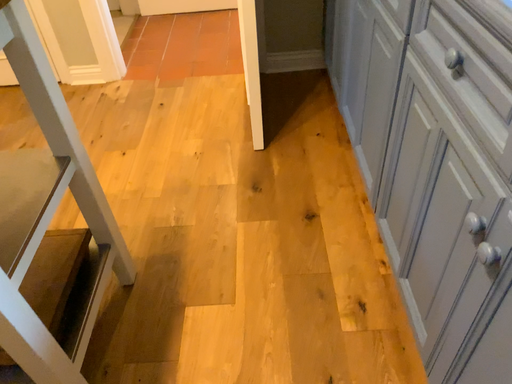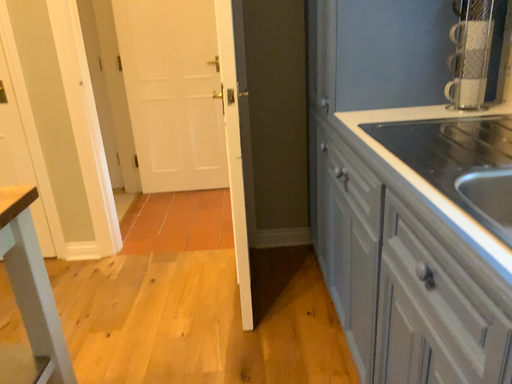
Question: Which way did the camera rotate in the video?

Choices:
 (A) rotated downward
 (B) rotated upward

Answer: (B)